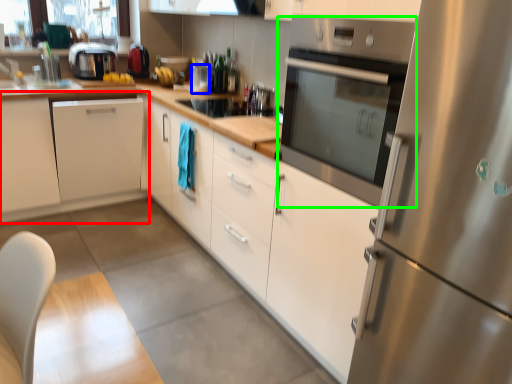
Question: Which is nearer to the cabinetry (highlighted by a red box)? appliance (highlighted by a blue box) or home appliance (highlighted by a green box).

Choices:
 (A) appliance
 (B) home appliance

Answer: (A)